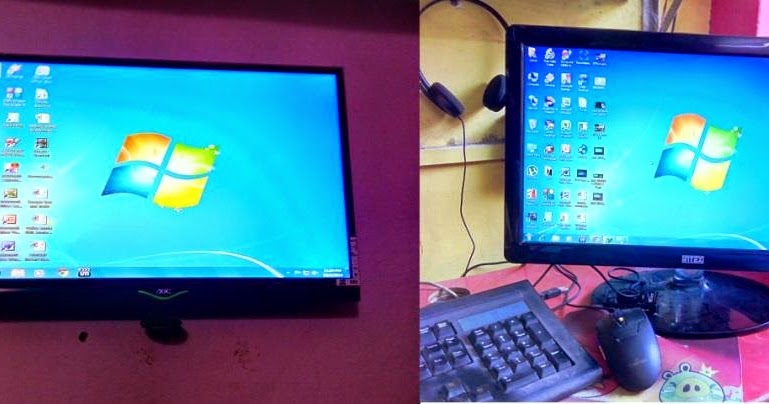
Where is `mouse`? The width and height of the screenshot is (769, 404). mouse is located at coordinates (636, 350).